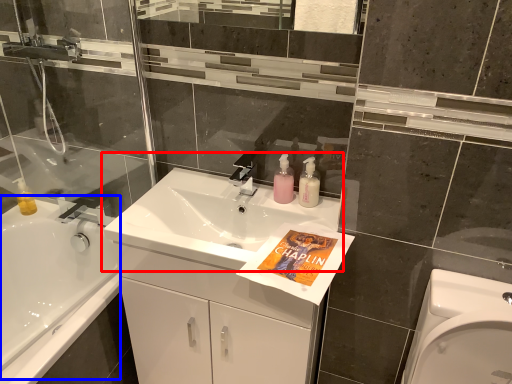
Question: Which object appears farthest to the camera in this image, sink (highlighted by a red box) or bath (highlighted by a blue box)?

Choices:
 (A) sink
 (B) bath

Answer: (B)